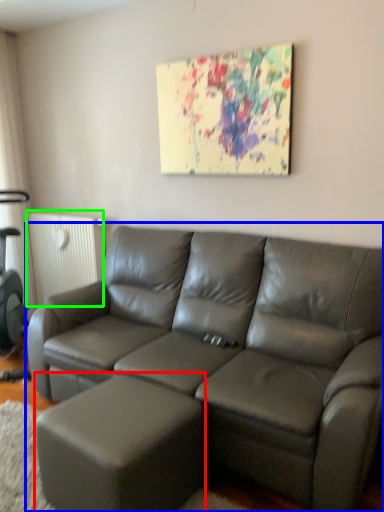
Question: Based on their relative distances, which object is farther from bar stool (highlighted by a red box)? Choose from studio couch (highlighted by a blue box) and radiator (highlighted by a green box).

Choices:
 (A) studio couch
 (B) radiator

Answer: (B)